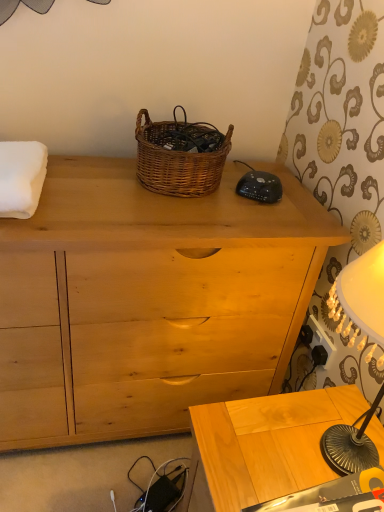
What are the coordinates of `free space to the left of woven brown picnic basket at center` in the screenshot? It's located at (96, 172).